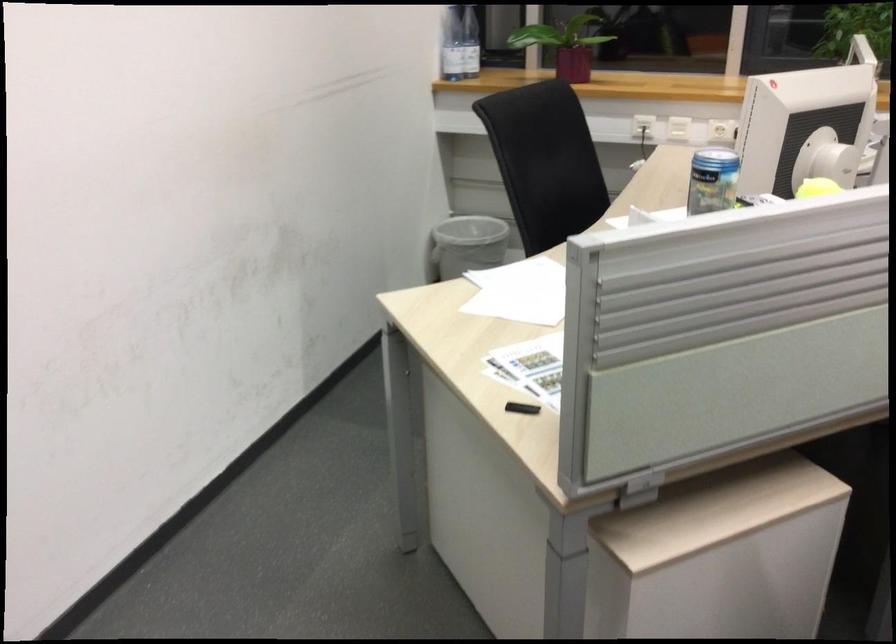
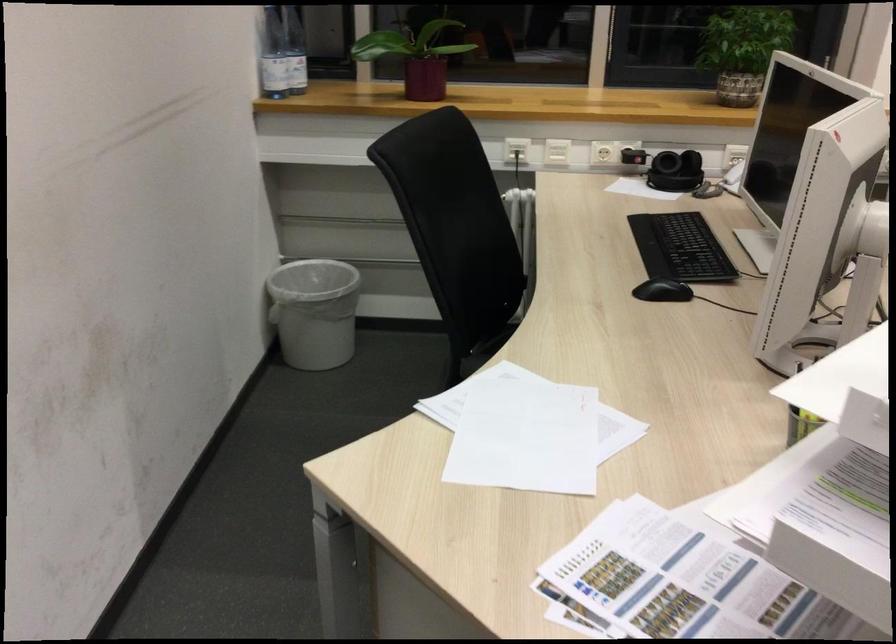
Question: How did the camera likely rotate?

Choices:
 (A) Left
 (B) Right
 (C) Up
 (D) Down

Answer: (B)